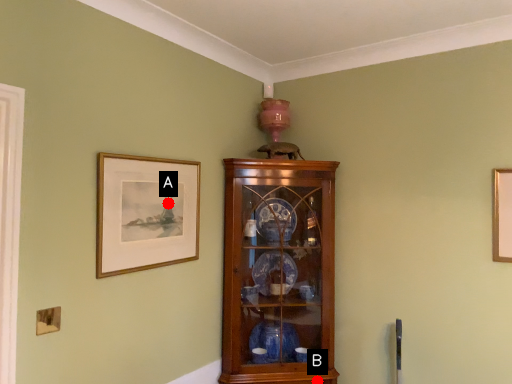
Question: Two points are circled on the image, labeled by A and B beside each circle. Which of the following is the closest to the observer?

Choices:
 (A) A is closer
 (B) B is closer

Answer: (A)